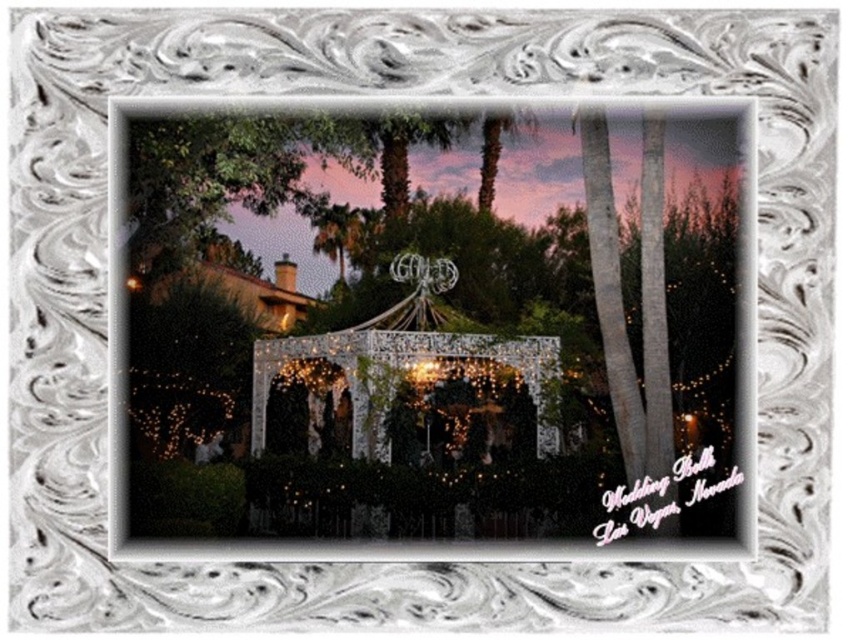
Question: Can you confirm if white lace gazebo at center is bigger than ivory lace gazebo at center?

Choices:
 (A) no
 (B) yes

Answer: (B)

Question: Among these objects, which one is nearest to the camera?

Choices:
 (A) ivory lace gazebo at center
 (B) white lace gazebo at center

Answer: (A)

Question: Which point is closer to the camera?

Choices:
 (A) (413, 353)
 (B) (660, 518)

Answer: (A)

Question: In this image, where is white lace gazebo at center located relative to ivory lace gazebo at center?

Choices:
 (A) below
 (B) above

Answer: (B)

Question: Can you confirm if white lace gazebo at center is positioned below ivory lace gazebo at center?

Choices:
 (A) no
 (B) yes

Answer: (A)